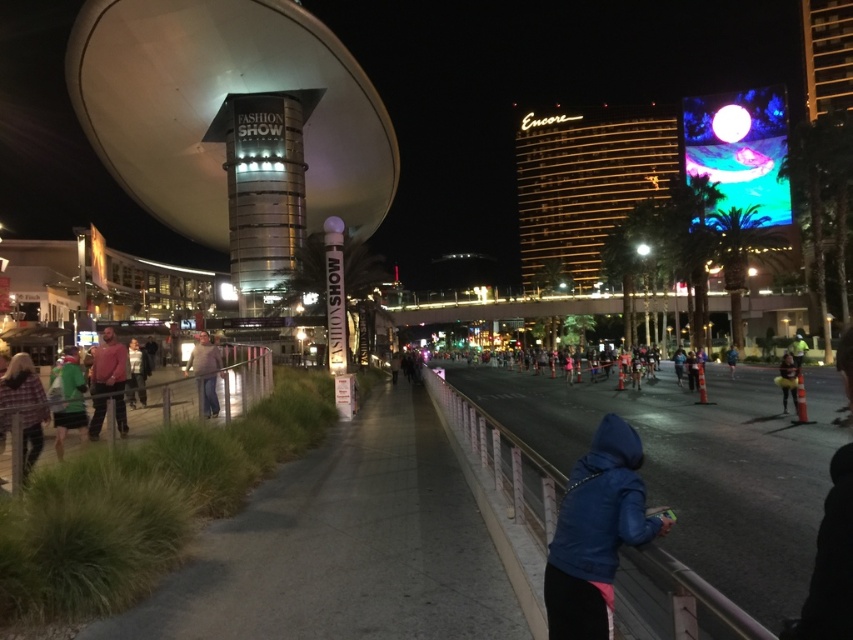
How much distance is there between green fabric shirt at left and blue fabric jacket at center-right?

green fabric shirt at left is 34.09 meters from blue fabric jacket at center-right.

Does green fabric shirt at left have a larger size compared to blue fabric jacket at center-right?

Yes, green fabric shirt at left is bigger than blue fabric jacket at center-right.

Who is more forward, (68, 364) or (734, 365)?

Point (68, 364) is more forward.

The width and height of the screenshot is (853, 640). I want to click on green fabric shirt at left, so click(x=68, y=401).

Is blue matte jacket at lower right taller than green fabric shirt at left?

No, blue matte jacket at lower right is not taller than green fabric shirt at left.

Is blue matte jacket at lower right wider than green fabric shirt at left?

No, blue matte jacket at lower right is not wider than green fabric shirt at left.

Does point (564, 515) come closer to viewer compared to point (70, 390)?

Yes, point (564, 515) is in front of point (70, 390).

Locate an element on the screen. The width and height of the screenshot is (853, 640). blue matte jacket at lower right is located at coordinates (596, 532).

Between blue matte jacket at lower right and plaid shirt at lower left, which one is positioned lower?

blue matte jacket at lower right

Is point (596, 548) closer to camera compared to point (28, 444)?

That is True.

Identify the location of blue matte jacket at lower right. (596, 532).